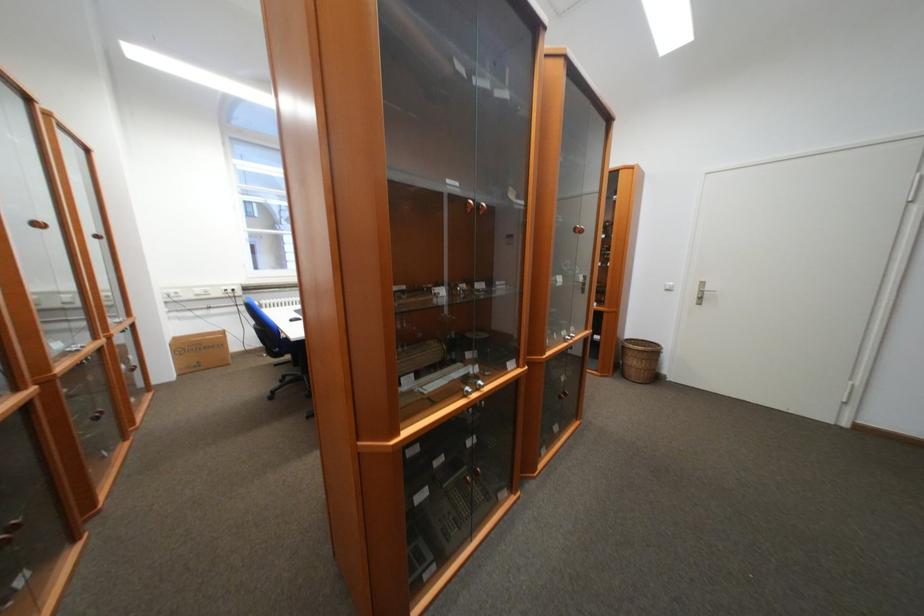
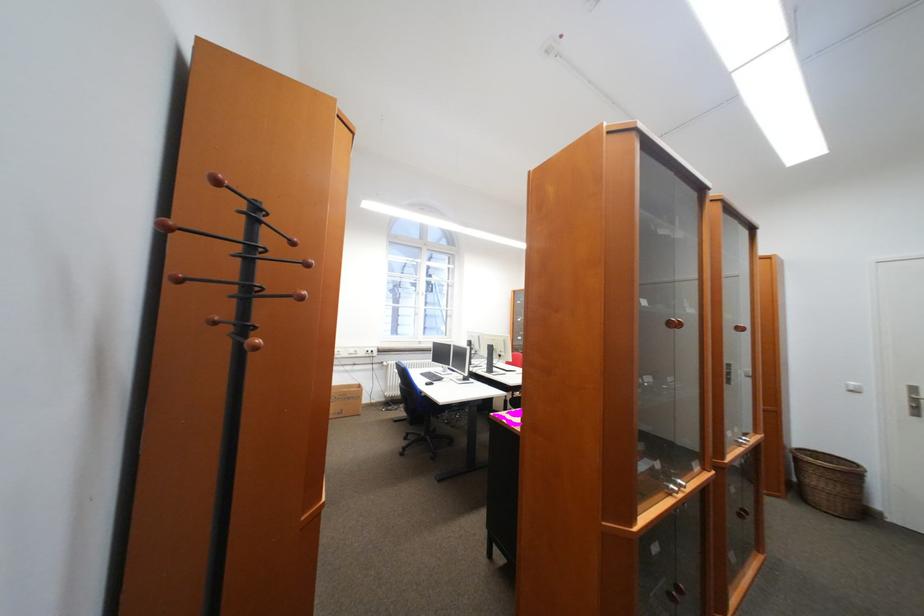
The point at (490, 383) is marked in the first image. Where is the corresponding point in the second image?

(689, 482)